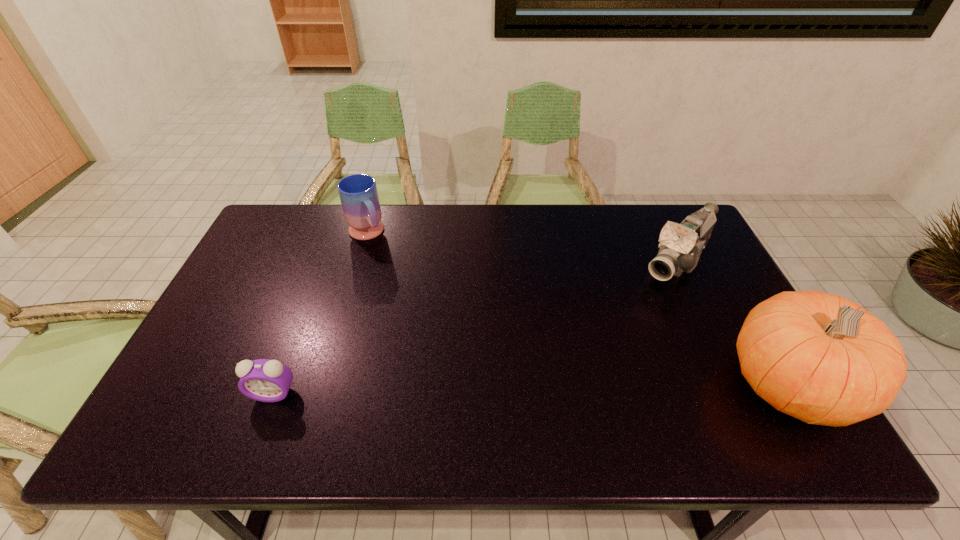
Identify the location of alarm clock. click(x=264, y=380).

At what (x,y) coordinates should I click in order to perform the action: click on pumpkin. Please return your answer as a coordinate pair (x, y). This screenshot has height=540, width=960. Looking at the image, I should click on (818, 357).

Locate an element on the screen. The width and height of the screenshot is (960, 540). mug is located at coordinates (358, 193).

You are a GUI agent. You are given a task and a screenshot of the screen. Output one action in this format:
    pyautogui.click(x=<x>, y=<y>)
    Task: Click on the camcorder
    The height and width of the screenshot is (540, 960).
    Given the screenshot: What is the action you would take?
    pyautogui.click(x=681, y=245)

At what (x,y) coordinates should I click in order to perform the action: click on free space located on the side of the mug with the handle. Please return your answer as a coordinate pair (x, y). Looking at the image, I should click on (425, 318).

Where is `vacant point located on the side of the mug with the handle`? This screenshot has width=960, height=540. vacant point located on the side of the mug with the handle is located at coordinates (388, 266).

Find the location of `free region located on the side of the mug with the handle`. free region located on the side of the mug with the handle is located at coordinates (425, 318).

In order to click on vacant space located 0.080m on the front-facing side of the camcorder in this screenshot , I will do `click(646, 298)`.

Find the location of a particular element. This screenshot has width=960, height=540. vacant space located on the front-facing side of the camcorder is located at coordinates (608, 341).

The width and height of the screenshot is (960, 540). What are the coordinates of `vacant space located on the front-facing side of the camcorder` in the screenshot? It's located at (644, 300).